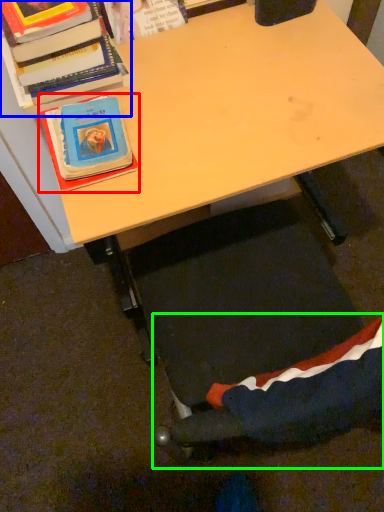
Question: Which object is positioned closest to book (highlighted by a red box)? Select from book (highlighted by a blue box) and swivel chair (highlighted by a green box).

Choices:
 (A) book
 (B) swivel chair

Answer: (A)